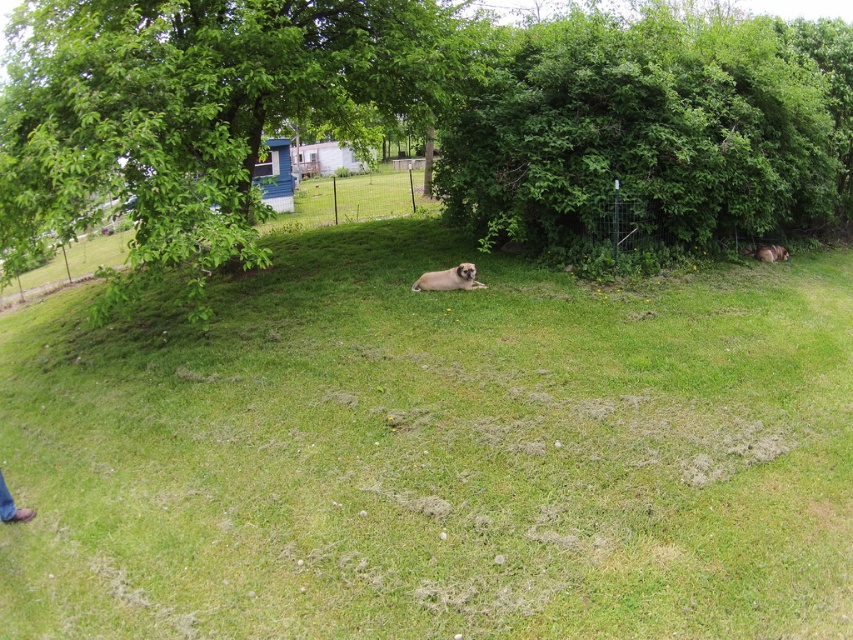
You are a gardener who needs to walk from the brown leather shoes at lower left to the edge of the grassy lawn. Is the path clear of the brown furry dog at center?

The brown furry dog at center is above brown leather shoes at lower left, meaning it is positioned closer to the viewer. Since the dog is in the middle ground and the shoes are in the lower left foreground, the path from the shoes to the lawn edge might be blocked by the dog. However, without knowing the exact direction of the path, it is hard to say for sure. The dog is not directly in the path unless the gardener walks towards the center where the dog is located.

You are standing at the point with coordinates [448,280] in the image. What object is located exactly at this point?

The brown furry dog at center is located exactly at point [448,280].